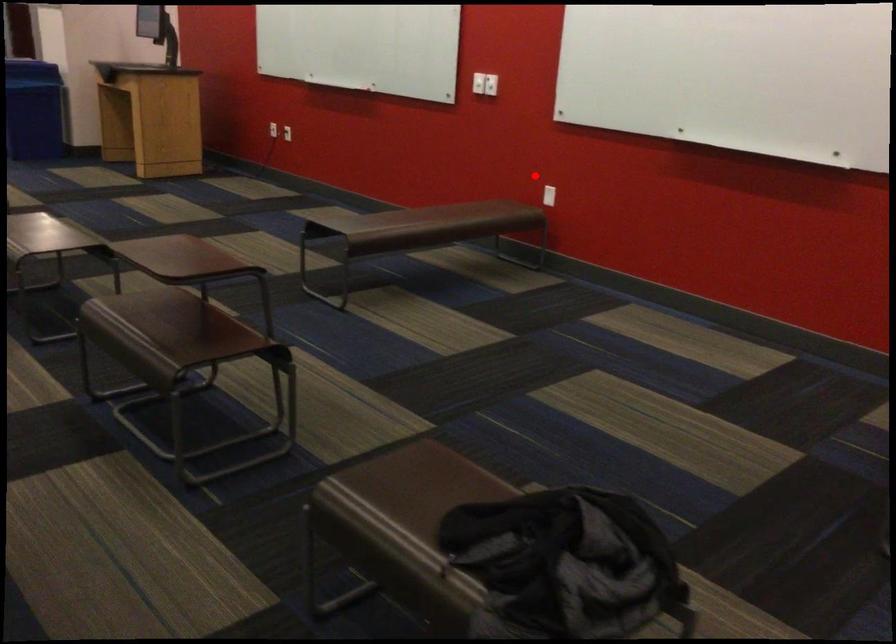
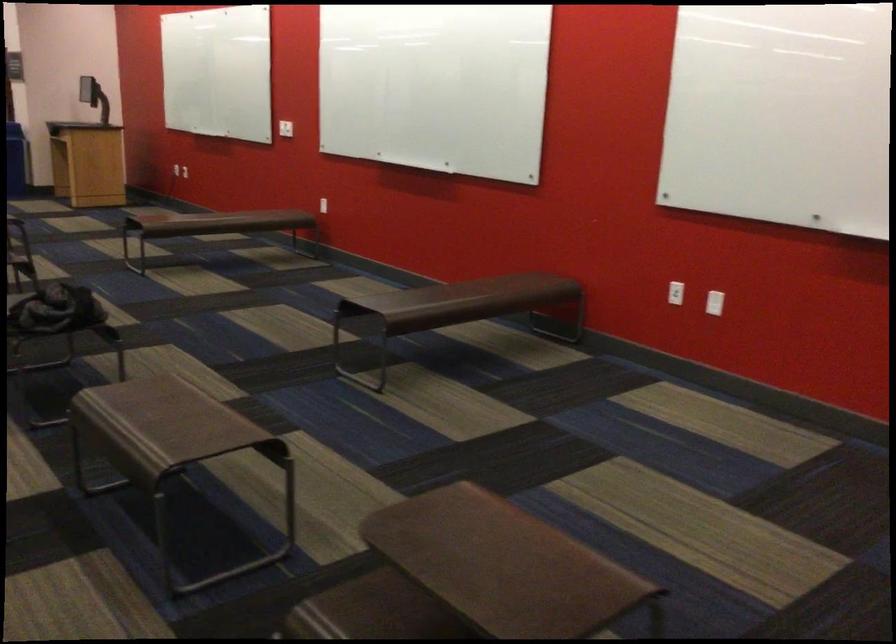
In the second image, find the point that corresponds to the highlighted location in the first image.

(323, 205)